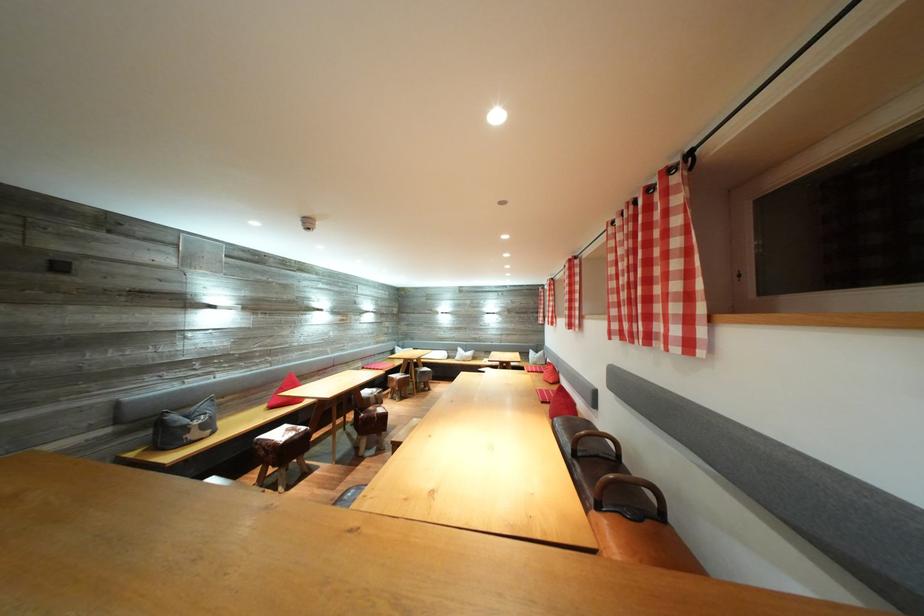
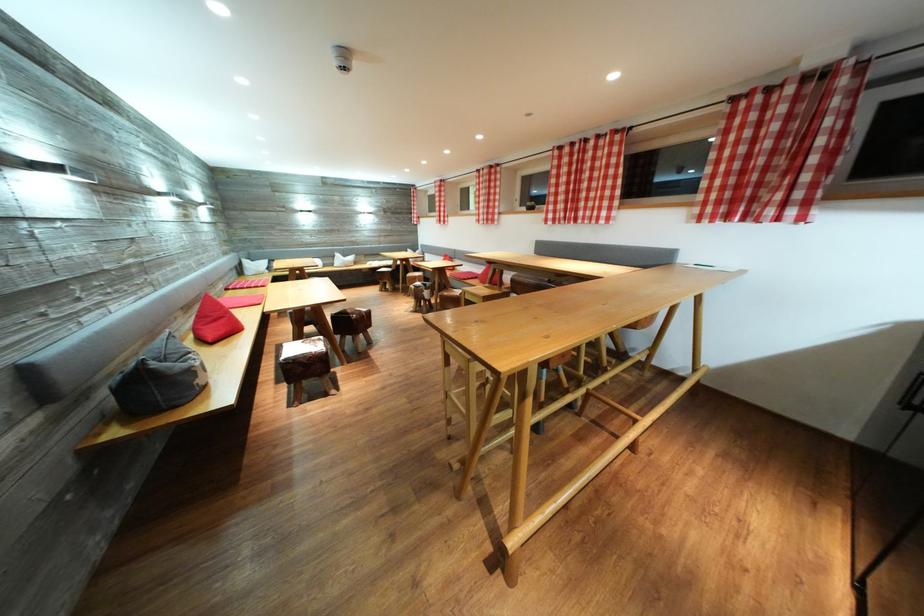
Find the pixel in the second image that matches point 287,394 in the first image.

(207, 323)